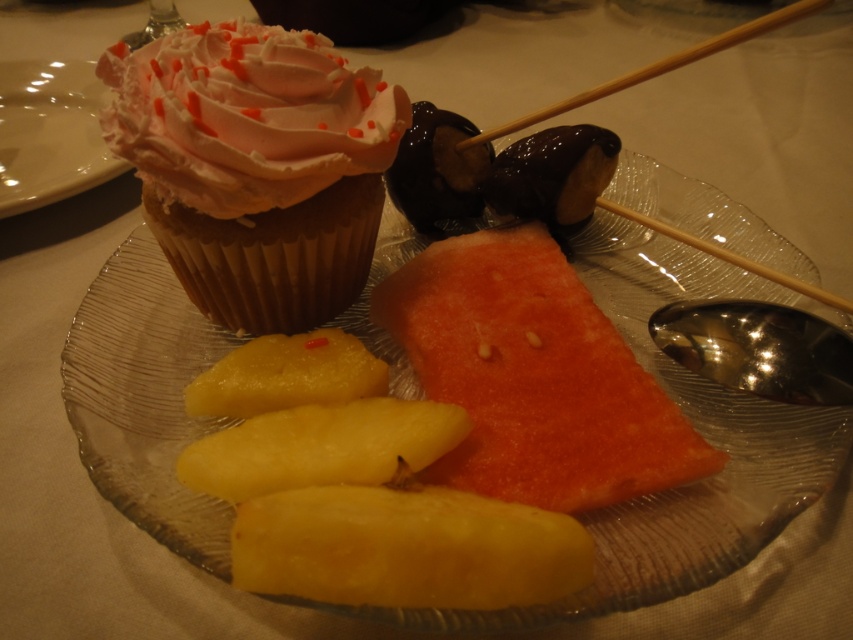
Which of these two, translucent glass plate at upper center or yellow smooth pineapple at lower center, stands taller?

With more height is translucent glass plate at upper center.

Locate an element on the screen. The width and height of the screenshot is (853, 640). translucent glass plate at upper center is located at coordinates (699, 433).

Can you confirm if matte pink frosting cupcake at upper left is bigger than wooden chopstick at upper center?

Yes, matte pink frosting cupcake at upper left is bigger than wooden chopstick at upper center.

Is matte pink frosting cupcake at upper left thinner than wooden chopstick at upper center?

Correct, matte pink frosting cupcake at upper left's width is less than wooden chopstick at upper center's.

Who is more distant from viewer, (210, 202) or (786, 8)?

The point (210, 202) is more distant.

Find the location of a particular element. matte pink frosting cupcake at upper left is located at coordinates (256, 166).

Does matte pink cupcake at upper left have a larger size compared to wooden chopsticks at upper right?

Correct, matte pink cupcake at upper left is larger in size than wooden chopsticks at upper right.

Image resolution: width=853 pixels, height=640 pixels. Find the location of `matte pink cupcake at upper left`. matte pink cupcake at upper left is located at coordinates (50, 132).

Locate an element on the screen. The height and width of the screenshot is (640, 853). matte pink cupcake at upper left is located at coordinates (50, 132).